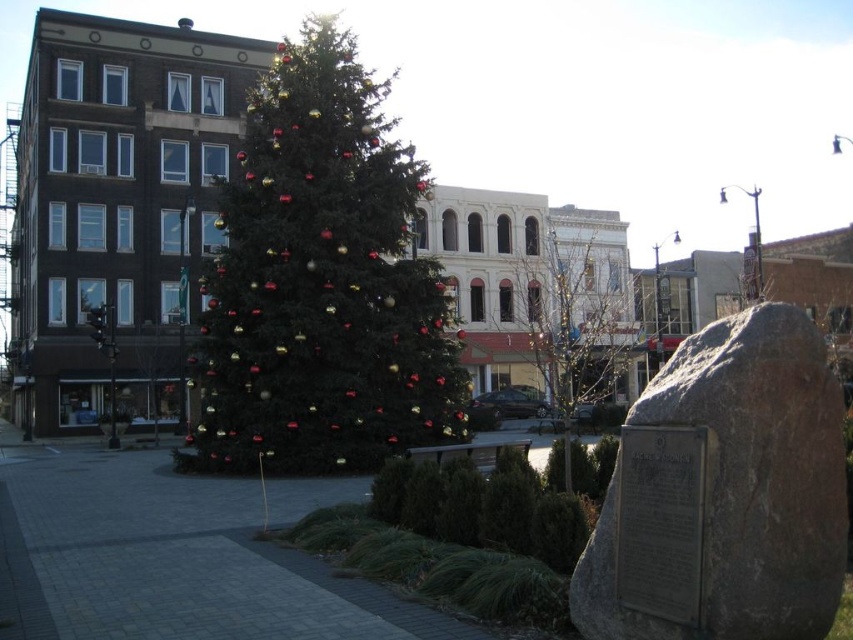
Question: Can you confirm if gray rock at center is thinner than green textured tree at center?

Choices:
 (A) no
 (B) yes

Answer: (B)

Question: Which point is closer to the camera taking this photo?

Choices:
 (A) (601, 317)
 (B) (755, 420)

Answer: (B)

Question: Which point is closer to the camera?

Choices:
 (A) green matte christmas tree at center
 (B) gray rock at center

Answer: (B)

Question: Is gray rock at center positioned behind green textured tree at center?

Choices:
 (A) no
 (B) yes

Answer: (A)

Question: Does green matte christmas tree at center appear on the right side of green textured tree at center?

Choices:
 (A) yes
 (B) no

Answer: (B)

Question: Which of the following is the farthest from the observer?

Choices:
 (A) (769, 592)
 (B) (653, 342)

Answer: (B)